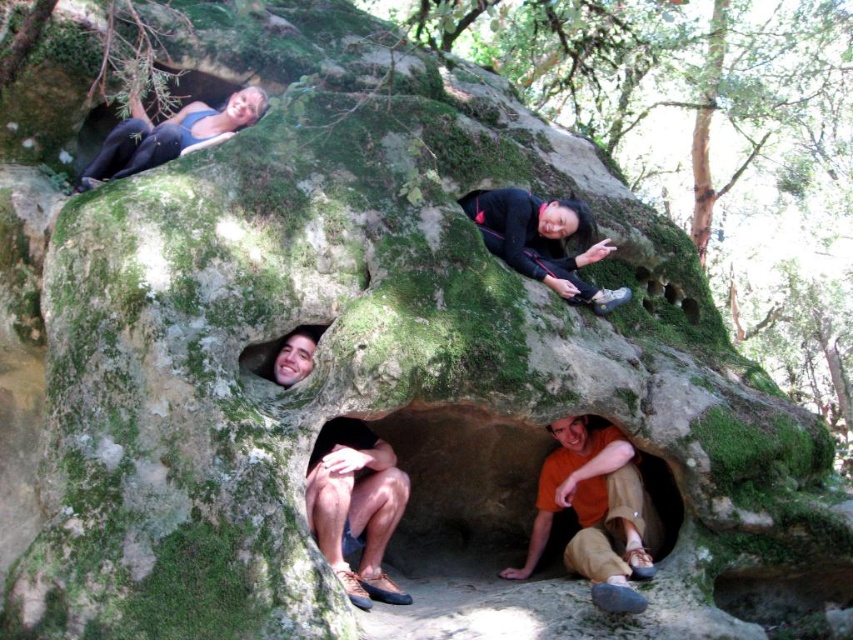
Question: Does orange cotton shirt at lower center lie in front of smooth stone face at center?

Choices:
 (A) yes
 (B) no

Answer: (B)

Question: Estimate the real-world distances between objects in this image. Which object is farther from the orange cotton shirt at lower center?

Choices:
 (A) brown suede shoes at lower center
 (B) smooth stone face at center
 (C) matte black tank top at upper left

Answer: (C)

Question: Which object is farther from the camera taking this photo?

Choices:
 (A) orange cotton shirt at lower center
 (B) black fabric jacket at upper right

Answer: (B)

Question: Is brown suede shoes at lower center further to camera compared to matte black tank top at upper left?

Choices:
 (A) no
 (B) yes

Answer: (A)

Question: Considering the real-world distances, which object is farthest from the smooth stone face at center?

Choices:
 (A) black fabric jacket at upper right
 (B) matte black tank top at upper left
 (C) brown suede shoes at lower center
 (D) orange cotton shirt at lower center

Answer: (D)

Question: Is orange cotton shirt at lower center bigger than black fabric jacket at upper right?

Choices:
 (A) yes
 (B) no

Answer: (A)